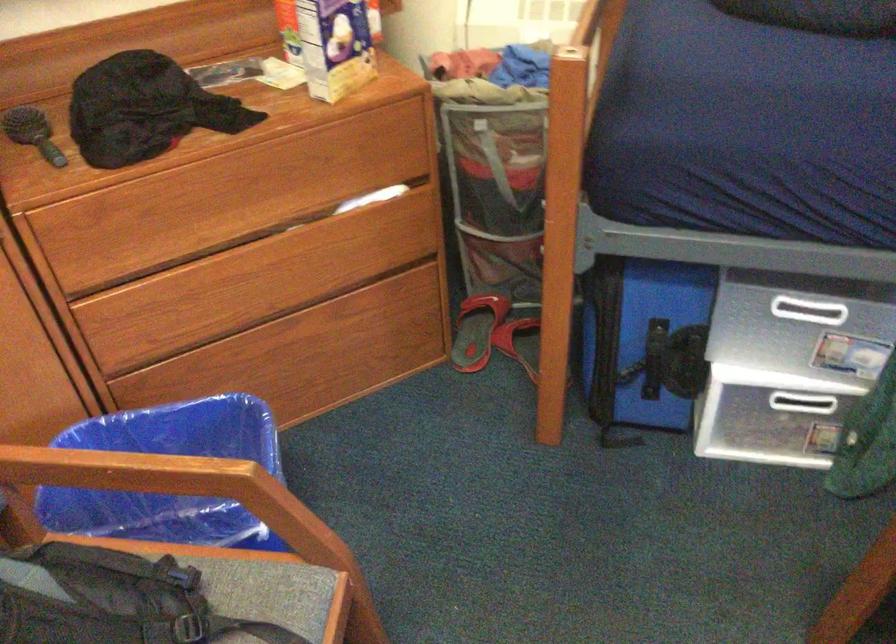
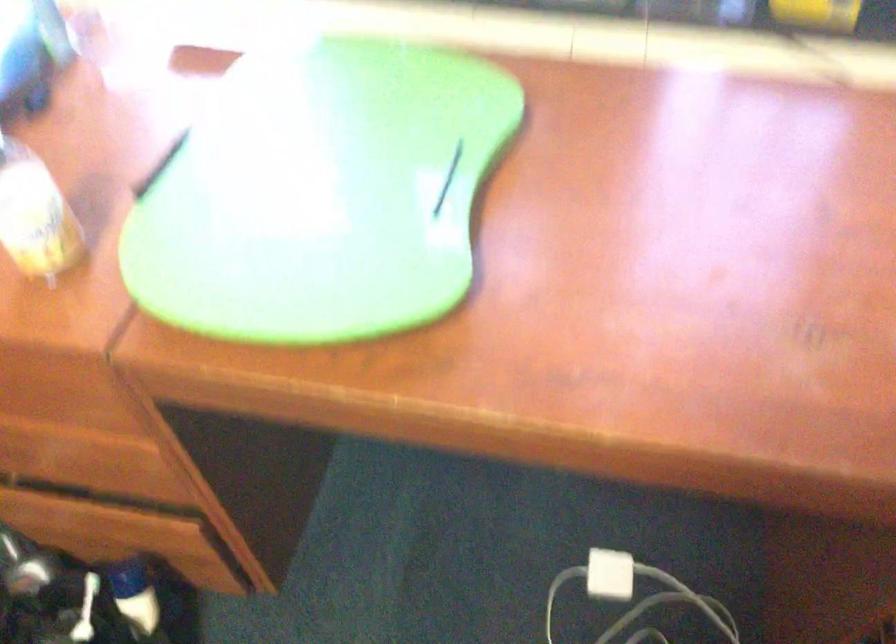
How did the camera likely rotate?

The rotation direction of the camera is right-down.